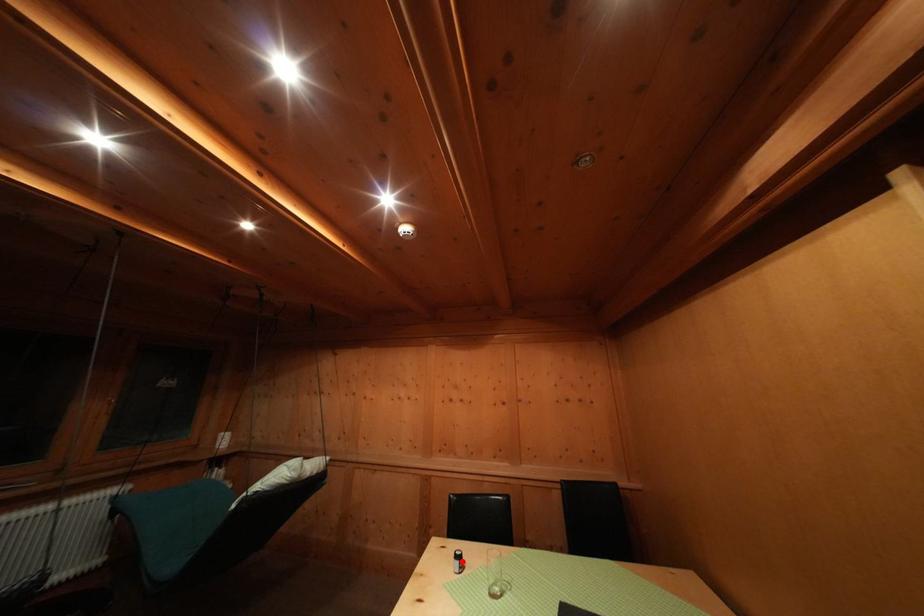
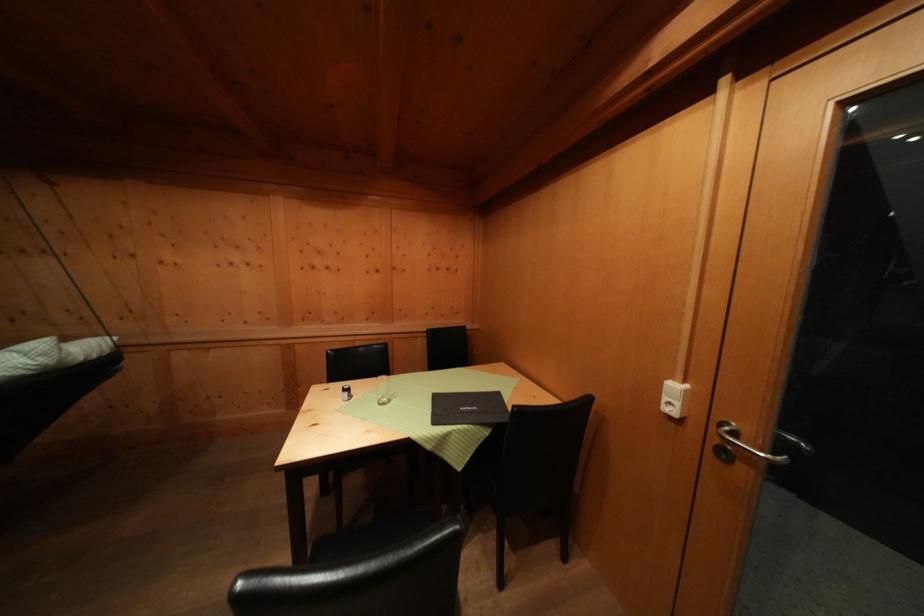
The point at the highlighted location is marked in the first image. Where is the corresponding point in the second image?

(350, 395)